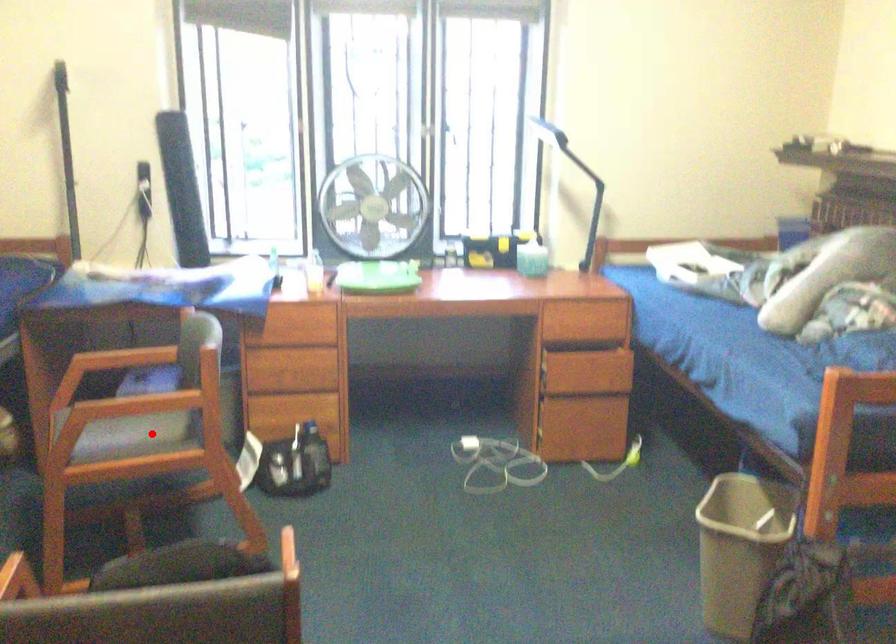
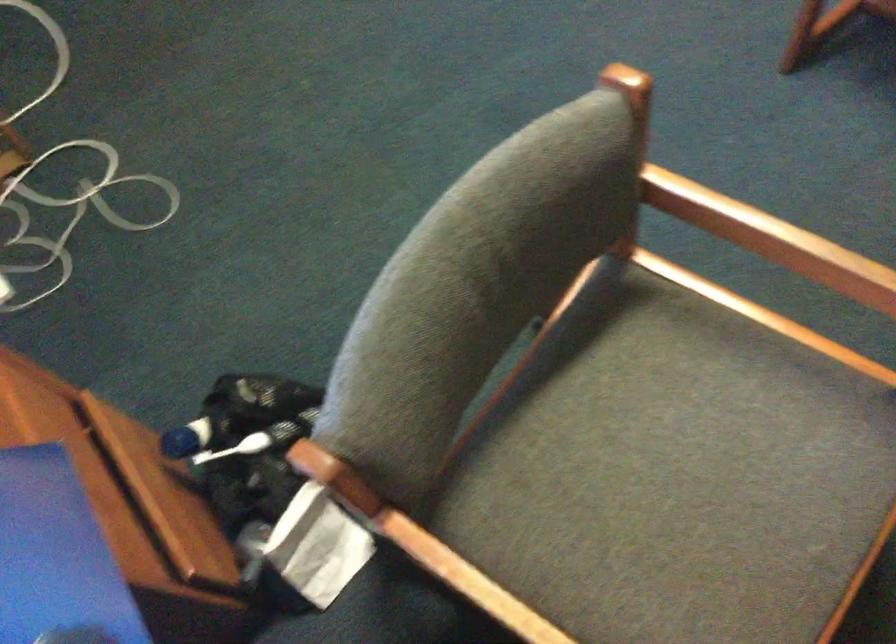
Where in the second image is the point corresponding to the highlighted location from the first image?

(643, 444)